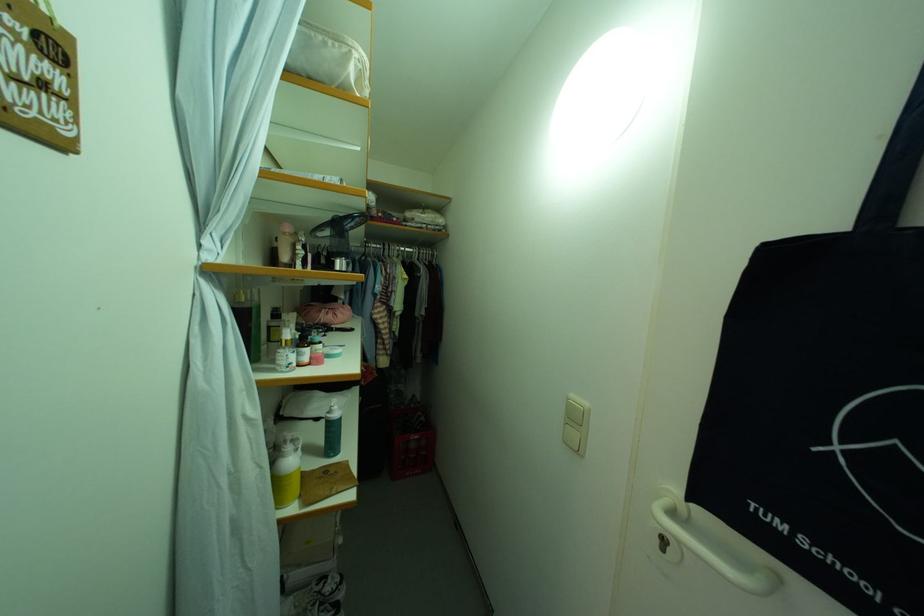
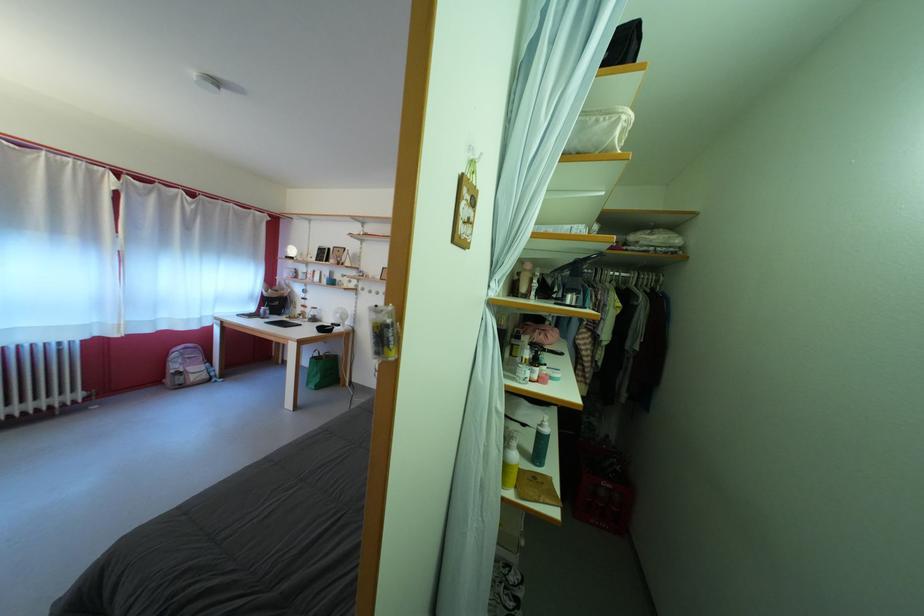
The point at (337, 418) is marked in the first image. Where is the corresponding point in the second image?

(549, 431)